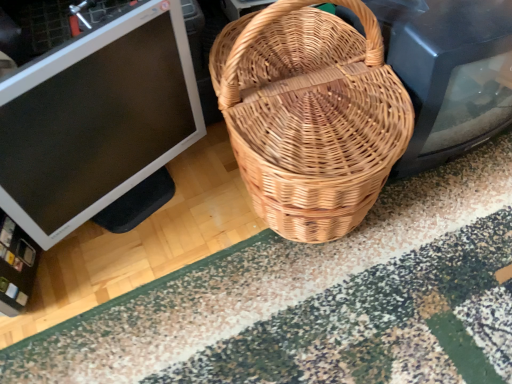
Question: Based on their sizes in the image, would you say matte black monitor at left is bigger or smaller than patterned carpet at center?

Choices:
 (A) big
 (B) small

Answer: (A)

Question: Is matte black monitor at left wider or thinner than patterned carpet at center?

Choices:
 (A) thin
 (B) wide

Answer: (A)

Question: Estimate the real-world distances between objects in this image. Which object is farther from the patterned carpet at center?

Choices:
 (A) matte black monitor at left
 (B) natural woven picnic basket at center

Answer: (A)

Question: Considering the real-world distances, which object is closest to the matte black monitor at left?

Choices:
 (A) patterned carpet at center
 (B) natural woven picnic basket at center

Answer: (B)